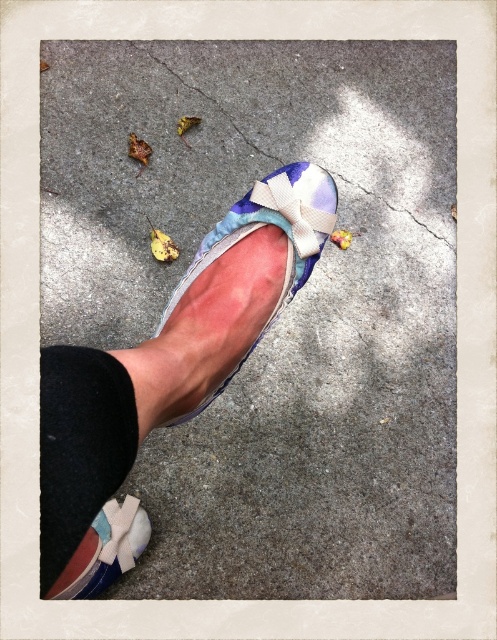
You are a delivery robot navigating a sidewalk. You see the gray concrete sidewalk at center and the cracked concrete at center. Which path should you choose to avoid the cracked area?

You should choose the gray concrete sidewalk at center because it is to the left of the cracked concrete at center, indicating it is a smoother path away from the cracked area.

You are a delivery robot that needs to move from the black fabric ankle at lower left to the gray concrete sidewalk at center. Can you move directly to the sidewalk without stepping on any debris?

The gray concrete sidewalk at center is positioned on the right side of black fabric ankle at lower left, so yes, the robot can move directly to the gray concrete sidewalk at center without stepping on debris as the path is clear to the right side.